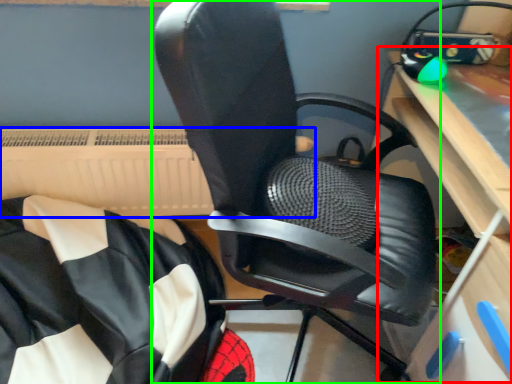
Question: Which object is the closest to the computer desk (highlighted by a red box)? Choose among these: radiator (highlighted by a blue box) or chair (highlighted by a green box).

Choices:
 (A) radiator
 (B) chair

Answer: (B)